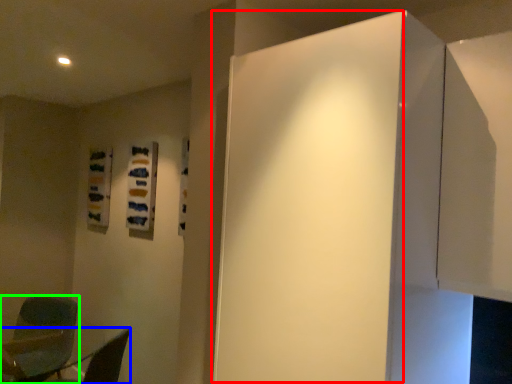
Question: Which object is the closest to the door (highlighted by a red box)? Choose among these: furniture (highlighted by a blue box) or chair (highlighted by a green box).

Choices:
 (A) furniture
 (B) chair

Answer: (A)